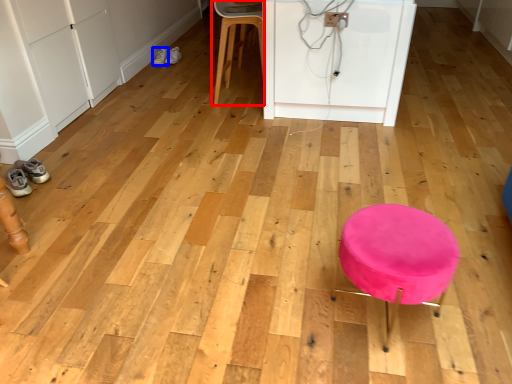
Question: Which point is closer to the camera, chair (highlighted by a red box) or footwear (highlighted by a blue box)?

Choices:
 (A) chair
 (B) footwear

Answer: (A)